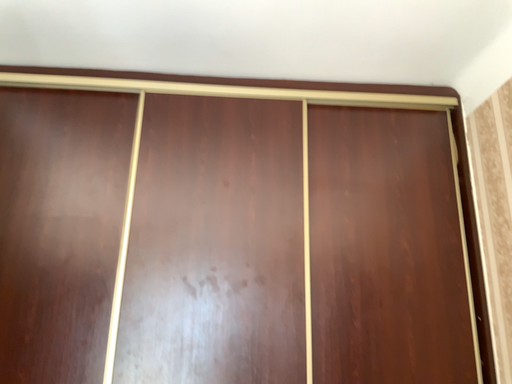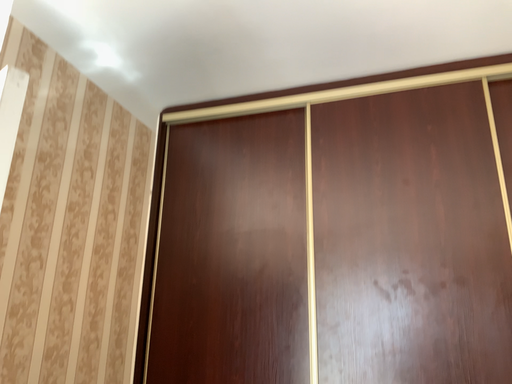
Question: Which way did the camera rotate in the video?

Choices:
 (A) rotated right
 (B) rotated left

Answer: (B)